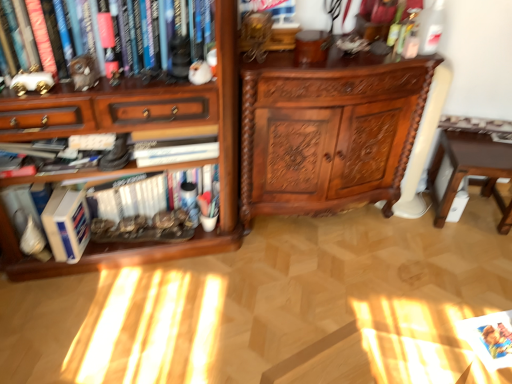
Question: Considering the positions of wooden bookcase at left and matte white figurine at upper left, the 1th book when ordered from top to bottom, in the image, is wooden bookcase at left wider or thinner than matte white figurine at upper left, the 1th book when ordered from top to bottom,?

Choices:
 (A) thin
 (B) wide

Answer: (B)

Question: In terms of size, does wooden bookcase at left appear bigger or smaller than matte white figurine at upper left, the 1th book when ordered from top to bottom?

Choices:
 (A) small
 (B) big

Answer: (B)

Question: Estimate the real-world distances between objects in this image. Which object is farther from the polished wood cabinet at center?

Choices:
 (A) hardcover book at left, placed as the second book when sorted from front to back
 (B) wooden bookcase at left
 (C) matte white figurine at upper left, positioned as the second book in back-to-front order
 (D) brown wooden table at lower right

Answer: (C)

Question: Estimate the real-world distances between objects in this image. Which object is closer to the polished wood cabinet at center?

Choices:
 (A) matte white figurine at upper left, the 1th book when ordered from top to bottom
 (B) hardcover book at left, placed as the second book when sorted from front to back
 (C) wooden bookcase at left
 (D) brown wooden table at lower right

Answer: (C)